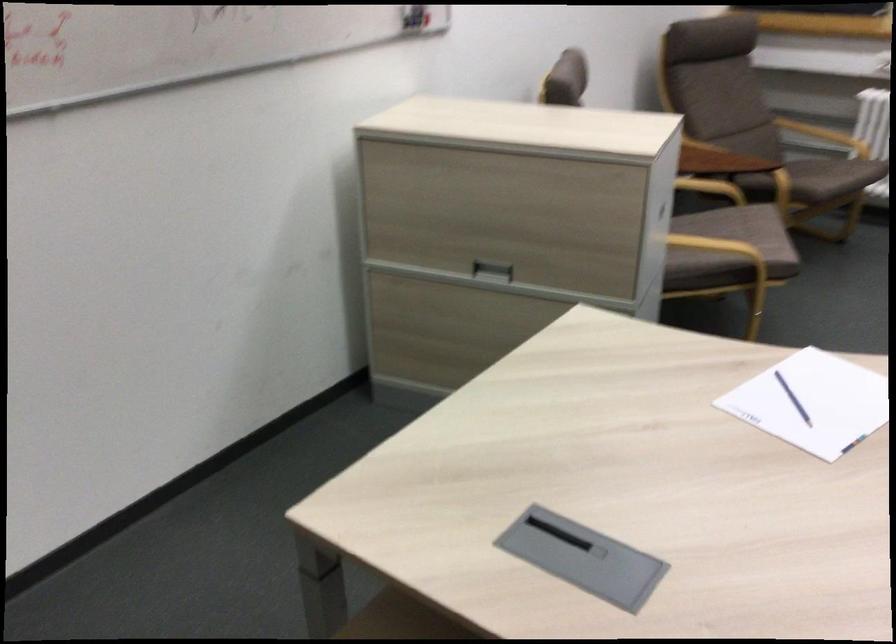
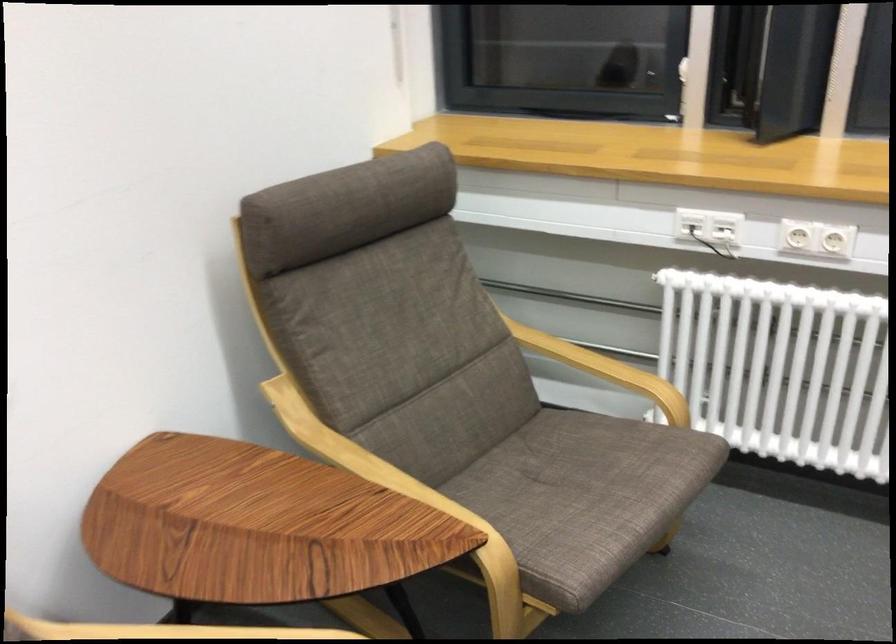
Looking at this image, the images are taken continuously from a first-person perspective. In which direction are you moving?

The movement direction of the cameraman is right, forward.